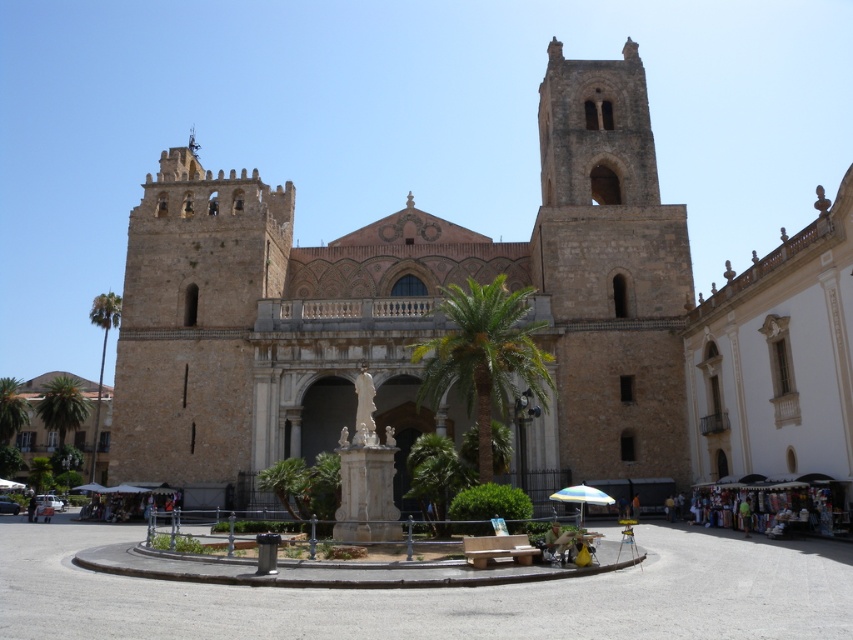
Between brown stone church at center and green leafy palm tree at left, which one is positioned higher?

Positioned higher is brown stone church at center.

Between point (608, 113) and point (90, 461), which one is positioned behind?

Positioned behind is point (90, 461).

The width and height of the screenshot is (853, 640). What are the coordinates of `brown stone church at center` in the screenshot? It's located at (405, 305).

Is brown stone tower at upper right further to the viewer compared to brown stone tower at left?

No, brown stone tower at upper right is in front of brown stone tower at left.

Does brown stone tower at upper right have a greater height compared to brown stone tower at left?

Yes, brown stone tower at upper right is taller than brown stone tower at left.

Does point (682, 419) lie behind point (202, 186)?

No, it is not.

Locate an element on the screen. The image size is (853, 640). brown stone tower at upper right is located at coordinates (610, 273).

Is brown stone church at center smaller than brown stone tower at upper right?

Incorrect, brown stone church at center is not smaller in size than brown stone tower at upper right.

Does brown stone church at center appear on the right side of brown stone tower at upper right?

No, brown stone church at center is not to the right of brown stone tower at upper right.

Which is behind, point (125, 456) or point (680, 220)?

The point (680, 220) is more distant.

Where is `brown stone church at center`? The image size is (853, 640). brown stone church at center is located at coordinates (405, 305).